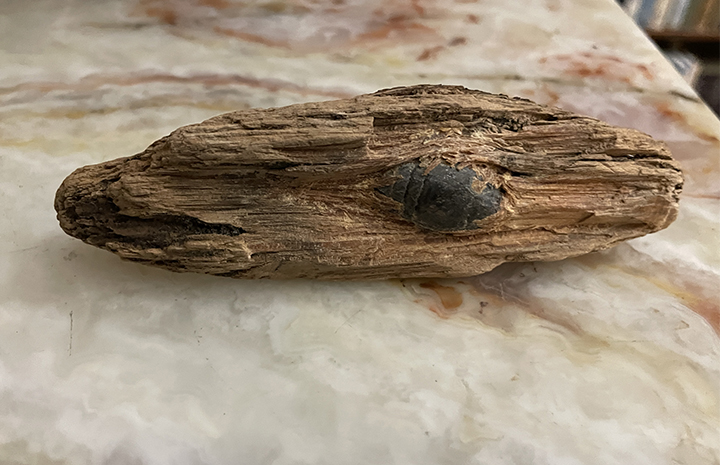
At what (x,y) coordinates should I click in order to perform the action: click on bookshelf. Please return your answer as a coordinate pair (x, y). Looking at the image, I should click on (693, 26).